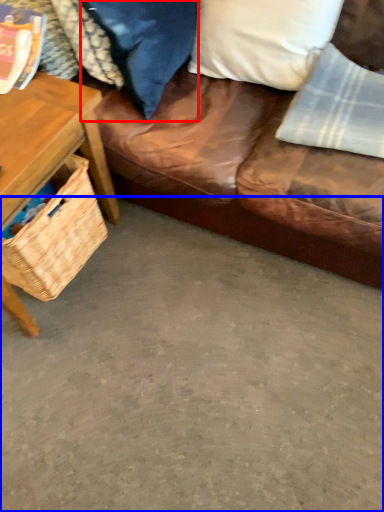
Question: Which object appears farthest to the camera in this image, pillow (highlighted by a red box) or concrete (highlighted by a blue box)?

Choices:
 (A) pillow
 (B) concrete

Answer: (A)